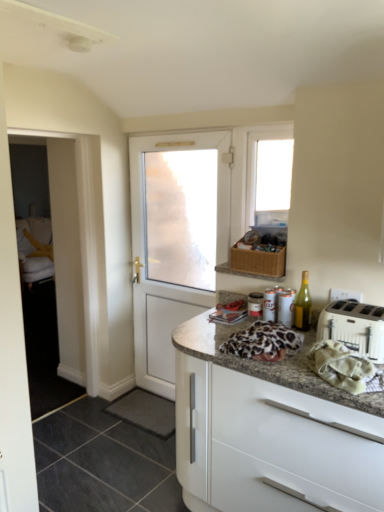
What do you see at coordinates (145, 412) in the screenshot? The image size is (384, 512). I see `black rubber mat at lower center, the second tile in the front-to-back sequence` at bounding box center [145, 412].

Where is `white matte door at center`? white matte door at center is located at coordinates (162, 259).

This screenshot has width=384, height=512. What do you see at coordinates (52, 329) in the screenshot?
I see `white glossy screen door at left` at bounding box center [52, 329].

In order to click on white glossy screen door at left in this screenshot , I will do `click(52, 329)`.

What are the coordinates of `dark gray tile at lower left, which is the 1th tile from front to back` in the screenshot? It's located at (102, 463).

From a real-world perspective, who is located lower, white glossy screen door at left or green glass bottle at right?

From a 3D spatial view, white glossy screen door at left is below.

Which object is closer to the camera, white glossy screen door at left or green glass bottle at right?

green glass bottle at right.

Considering the relative sizes of white glossy screen door at left and green glass bottle at right in the image provided, is white glossy screen door at left shorter than green glass bottle at right?

No.

Measure the distance from white glossy screen door at left to green glass bottle at right.

white glossy screen door at left and green glass bottle at right are 2.20 meters apart from each other.

Is transparent glass window at upper center directly adjacent to white glossy screen door at left?

No, transparent glass window at upper center is not beside white glossy screen door at left.

From the image's perspective, is transparent glass window at upper center under white glossy screen door at left?

No, from the image's perspective, transparent glass window at upper center is not below white glossy screen door at left.

Between transparent glass window at upper center and white glossy screen door at left, which one has larger size?

white glossy screen door at left is bigger.

From the image's perspective, which is below, white glossy cabinet at lower right or transparent glass window at upper center?

white glossy cabinet at lower right appears lower in the image.

Considering their positions, is white glossy cabinet at lower right located in front of or behind transparent glass window at upper center?

Clearly, white glossy cabinet at lower right is in front of transparent glass window at upper center.

Considering the points (236, 372) and (293, 124), which point is behind, point (236, 372) or point (293, 124)?

Point (293, 124)

I want to click on window that is behind the white glossy cabinet at lower right, so click(x=255, y=164).

Image resolution: width=384 pixels, height=512 pixels. What are the coordinates of `the 2nd tile to the left of the green glass bottle at right, counting from the anchor's position` in the screenshot? It's located at (102, 463).

Based on the photo, does dark gray tile at lower left, which ranks as the second tile in back-to-front order, have a greater height compared to green glass bottle at right?

No.

Measure the distance from dark gray tile at lower left, which ranks as the second tile in back-to-front order, to green glass bottle at right.

dark gray tile at lower left, which ranks as the second tile in back-to-front order, is 4.55 feet away from green glass bottle at right.

Does dark gray tile at lower left, which ranks as the second tile in back-to-front order, touch green glass bottle at right?

No, dark gray tile at lower left, which ranks as the second tile in back-to-front order, is not in contact with green glass bottle at right.

Considering the relative sizes of black rubber mat at lower center, the second tile in the front-to-back sequence, and white plastic toaster at right in the image provided, is black rubber mat at lower center, the second tile in the front-to-back sequence, wider than white plastic toaster at right?

Correct, the width of black rubber mat at lower center, the second tile in the front-to-back sequence, exceeds that of white plastic toaster at right.

Is point (138, 405) closer or farther from the camera than point (344, 314)?

Point (138, 405) is positioned farther from the camera compared to point (344, 314).

Which is correct: black rubber mat at lower center, which is the 1th tile from back to front, is inside white plastic toaster at right, or outside of it?

black rubber mat at lower center, which is the 1th tile from back to front, lies outside white plastic toaster at right.

What's the angular difference between black rubber mat at lower center, the second tile in the front-to-back sequence, and white plastic toaster at right's facing directions?

There is a 2.51-degree angle between the facing directions of black rubber mat at lower center, the second tile in the front-to-back sequence, and white plastic toaster at right.

Locate an element on the screen. cabinetry below the white glossy screen door at left (from a real-world perspective) is located at coordinates (272, 445).

Considering the sizes of objects white glossy cabinet at lower right and white glossy screen door at left in the image provided, who is shorter, white glossy cabinet at lower right or white glossy screen door at left?

white glossy cabinet at lower right is shorter.

Is white glossy cabinet at lower right placed right next to white glossy screen door at left?

No, white glossy cabinet at lower right is not making contact with white glossy screen door at left.

Are white glossy screen door at left and dark gray tile at lower left, which ranks as the second tile in back-to-front order, beside each other?

No, white glossy screen door at left is not next to dark gray tile at lower left, which ranks as the second tile in back-to-front order.

Is white glossy screen door at left positioned with its back to dark gray tile at lower left, which ranks as the second tile in back-to-front order?

That's not correct — white glossy screen door at left is not looking away from dark gray tile at lower left, which ranks as the second tile in back-to-front order.

Is white glossy screen door at left situated inside dark gray tile at lower left, which is the 1th tile from front to back, or outside?

white glossy screen door at left is outside dark gray tile at lower left, which is the 1th tile from front to back.

From a real-world perspective, is white glossy screen door at left under dark gray tile at lower left, which ranks as the second tile in back-to-front order?

No.

What are the coordinates of `wine bottle that appears below the white glossy screen door at left (from the image's perspective)` in the screenshot? It's located at (303, 305).

At what (x,y) coordinates should I click in order to perform the action: click on window in front of the white glossy screen door at left. Please return your answer as a coordinate pair (x, y). The width and height of the screenshot is (384, 512). Looking at the image, I should click on (255, 164).

Based on their spatial positions, is white glossy cabinet at lower right or white plastic toaster at right closer to transparent glass window at upper center?

Based on the image, white plastic toaster at right appears to be nearer to transparent glass window at upper center.

Considering their positions, is white glossy screen door at left positioned closer to dark gray tile at lower left, which ranks as the second tile in back-to-front order, than black rubber mat at lower center, the second tile in the front-to-back sequence?

black rubber mat at lower center, the second tile in the front-to-back sequence, lies closer to dark gray tile at lower left, which ranks as the second tile in back-to-front order, than the other object.

From the image, which object appears to be farther from white matte door at center, white glossy screen door at left or white plastic toaster at right?

white plastic toaster at right is further to white matte door at center.

Based on their spatial positions, is white cloth at right or metallic silver canister at upper right further from dark gray tile at lower left, which ranks as the second tile in back-to-front order?

white cloth at right.

Which object lies nearer to the anchor point white glossy cabinet at lower right, white matte door at center or dark gray tile at lower left, which is the 1th tile from front to back?

Among the two, dark gray tile at lower left, which is the 1th tile from front to back, is located nearer to white glossy cabinet at lower right.

From the image, which object appears to be farther from green glass bottle at right, metallic silver canister at upper right or white plastic toaster at right?

Based on the image, white plastic toaster at right appears to be further to green glass bottle at right.

Which object lies further to the anchor point transparent glass window at upper center, white matte door at center or green glass bottle at right?

Among the two, green glass bottle at right is located further to transparent glass window at upper center.

From the image, which object appears to be nearer to white plastic toaster at right, green glass bottle at right or transparent glass window at upper center?

green glass bottle at right lies closer to white plastic toaster at right than the other object.

Image resolution: width=384 pixels, height=512 pixels. Find the location of `screen door between white matte door at center and black rubber mat at lower center, the second tile in the front-to-back sequence, vertically`. screen door between white matte door at center and black rubber mat at lower center, the second tile in the front-to-back sequence, vertically is located at coordinates (52, 329).

Where is `tile positioned between white glossy cabinet at lower right and black rubber mat at lower center, which is the 1th tile from back to front, from near to far`? tile positioned between white glossy cabinet at lower right and black rubber mat at lower center, which is the 1th tile from back to front, from near to far is located at coordinates (102, 463).

Identify the location of appliance between transparent glass window at upper center and dark gray tile at lower left, which ranks as the second tile in back-to-front order, from top to bottom. This screenshot has height=512, width=384. (286, 308).

In order to click on appliance between white glossy cabinet at lower right and black rubber mat at lower center, which is the 1th tile from back to front, along the z-axis in this screenshot , I will do `click(286, 308)`.